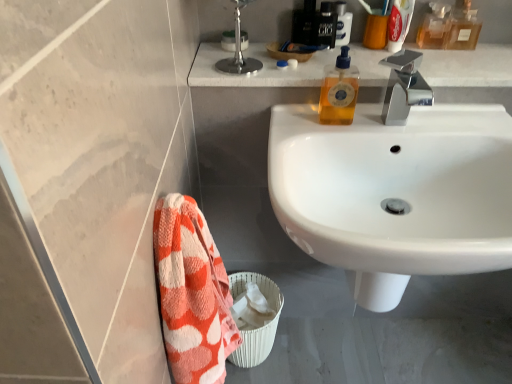
The width and height of the screenshot is (512, 384). I want to click on vacant area in front of yellow liquid soap at upper right, which appears as the 3th toiletry when viewed from the top, so click(327, 135).